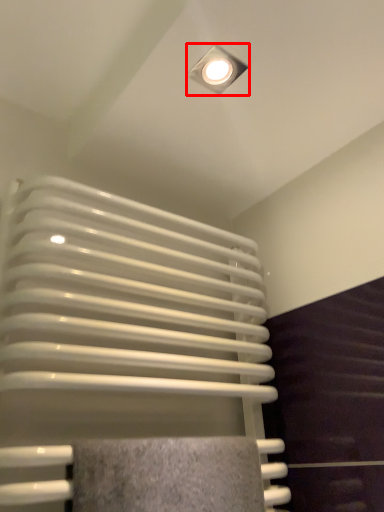
Question: From the image's perspective, considering the relative positions of lamp (annotated by the red box) and radiator in the image provided, where is lamp (annotated by the red box) located with respect to the staircase?

Choices:
 (A) below
 (B) above

Answer: (B)